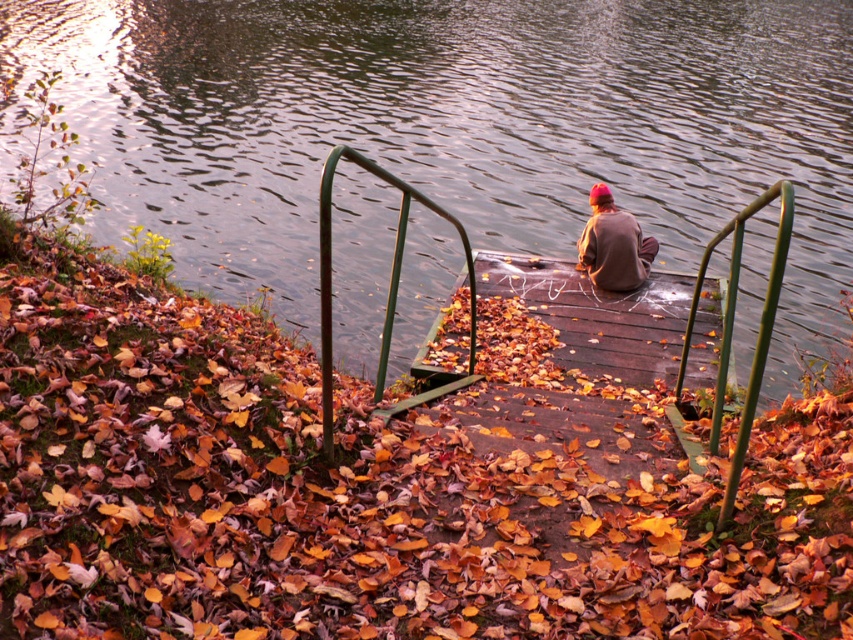
From the picture: You are standing on the wooden dock and want to place a small potted plant between the autumn leaves at center and the glossy water at upper center. Which object should you place it closer to if you want the plant to be higher up?

The glossy water at upper center is taller than autumn leaves at center, so placing the plant closer to the glossy water at upper center would position it higher up.

You are standing at the point labeled point (325, 291) and want to walk to the point labeled point (538, 273). Given the dock structure described in the scene, will you be moving towards the water or away from it?

Since point (538, 273) is behind point (325, 291), moving from point (325, 291) to point (538, 273) would mean moving away from the water. The dock extends into the water, so the direction towards the water is forward along the dock, while behind would be towards the shore.